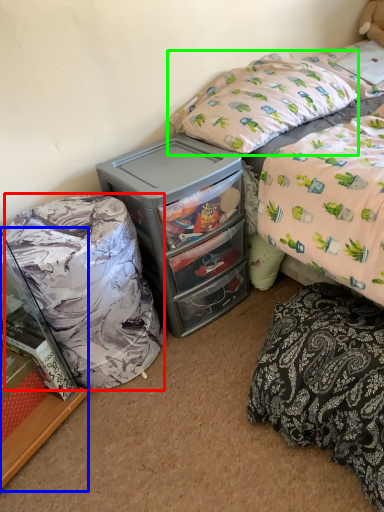
Question: Which object is positioned closest to bean bag chair (highlighted by a red box)? Select from cabinetry (highlighted by a blue box) and pillow (highlighted by a green box).

Choices:
 (A) cabinetry
 (B) pillow

Answer: (A)